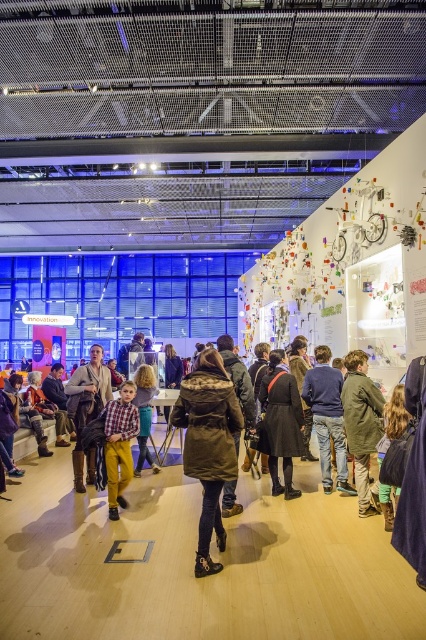
Between point (334, 412) and point (198, 380), which one is positioned behind?

The point (334, 412) is behind.

Is plaid shirt at center to the right of dark green textured coat at center from the viewer's perspective?

Correct, you'll find plaid shirt at center to the right of dark green textured coat at center.

Describe the element at coordinates (333, 444) in the screenshot. The height and width of the screenshot is (640, 426). I see `plaid shirt at center` at that location.

The width and height of the screenshot is (426, 640). In order to click on plaid shirt at center in this screenshot , I will do `click(333, 444)`.

Does green textured jacket at lower right appear under leather jacket at center?

Incorrect, green textured jacket at lower right is not positioned below leather jacket at center.

Which is in front, point (345, 385) or point (97, 381)?

Point (345, 385) is more forward.

Locate an element on the screen. green textured jacket at lower right is located at coordinates (362, 426).

Does black leather coat at center have a lesser height compared to green textured jacket at lower right?

Incorrect, black leather coat at center's height does not fall short of green textured jacket at lower right's.

Can you confirm if black leather coat at center is positioned to the right of green textured jacket at lower right?

Incorrect, black leather coat at center is not on the right side of green textured jacket at lower right.

Is point (279, 371) positioned behind point (350, 422)?

Yes, it is.

The image size is (426, 640). In order to click on black leather coat at center in this screenshot , I will do [279, 422].